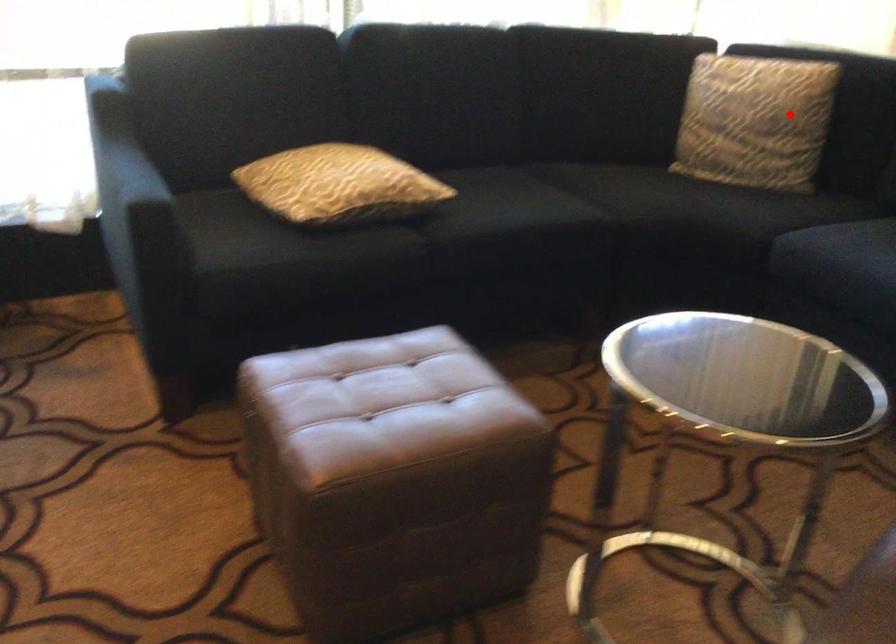
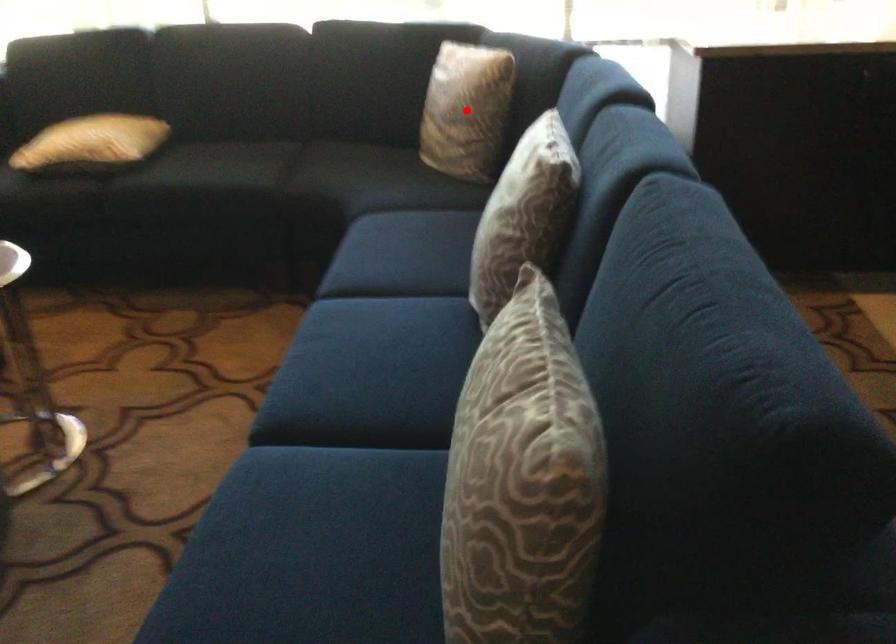
I am providing you with two images of the same scene from different viewpoints. A red point is marked on the first image and another point is marked on the second image. Is the marked point in image1 the same physical position as the marked point in image2?

Yes